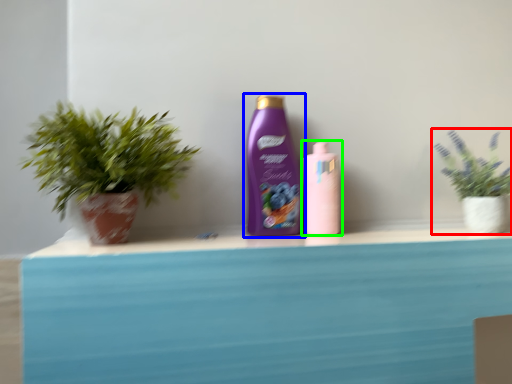
Question: Considering the real-world distances, which object is farthest from houseplant (highlighted by a red box)? bottle (highlighted by a blue box) or bottle (highlighted by a green box)?

Choices:
 (A) bottle
 (B) bottle

Answer: (A)